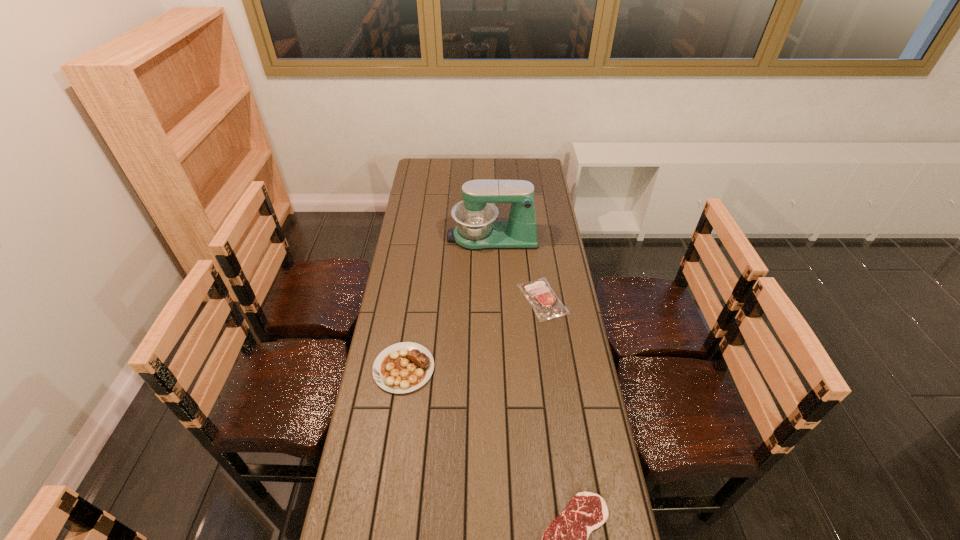
What are the coordinates of `the farthest object` in the screenshot? It's located at (476, 229).

Identify the location of mixer. (476, 229).

Locate an element on the screen. This screenshot has width=960, height=540. the tallest steak is located at coordinates (404, 367).

In order to click on the leftmost steak in this screenshot , I will do `click(404, 367)`.

Identify the location of the farthest steak. The width and height of the screenshot is (960, 540). [546, 305].

Identify the location of the third tallest object. This screenshot has height=540, width=960. (546, 305).

Image resolution: width=960 pixels, height=540 pixels. Find the location of `free space located 0.190m on the front-facing side of the farthest object`. free space located 0.190m on the front-facing side of the farthest object is located at coordinates (406, 237).

Identify the location of free space located on the front-facing side of the farthest object. The height and width of the screenshot is (540, 960). (408, 237).

What are the coordinates of `free space located on the front-facing side of the farthest object` in the screenshot? It's located at (401, 237).

I want to click on free space located on the front of the tallest steak, so click(x=391, y=458).